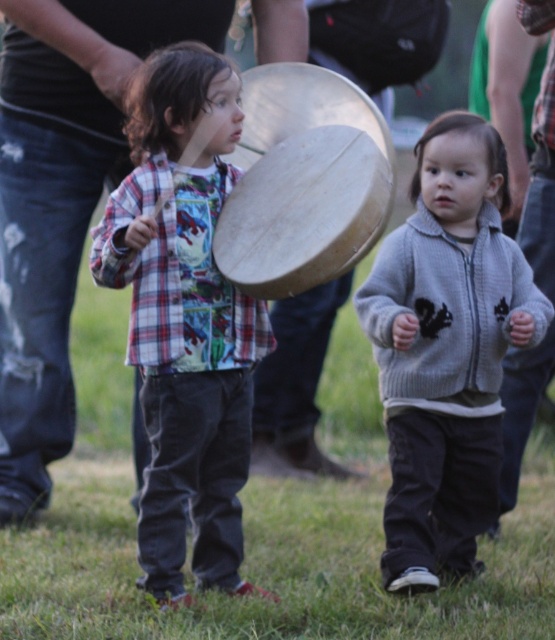
Based on the photo, you are a photographer trying to capture both the plaid shirt at center and the gray knitted sweater at center in a single frame. Which clothing item should you focus on first to ensure both are in focus?

The plaid shirt at center is smaller than the gray knitted sweater at center, so you should focus on the plaid shirt at center first to ensure both are in focus.

You are a photographer trying to capture a closeup of the plaid shirt at center. Given that the camera can focus on objects within a 0.1 unit radius from the point you select, would the plaid shirt at center be in focus if you focus at point [184,317]?

The plaid shirt at center is represented by point [184,317], so focusing at that point would place the plaid shirt at center within the 0.1 unit radius, ensuring it is in focus.

You are a photographer trying to capture a clear shot of both the gray knitted sweater at center and the wooden tambourine at center. Which object should you focus on first to ensure it appears sharp in the photo?

The gray knitted sweater at center is positioned under the wooden tambourine at center, so you should focus on the wooden tambourine at center first to ensure it remains sharp while the sweater may be slightly out of focus due to its lower position.